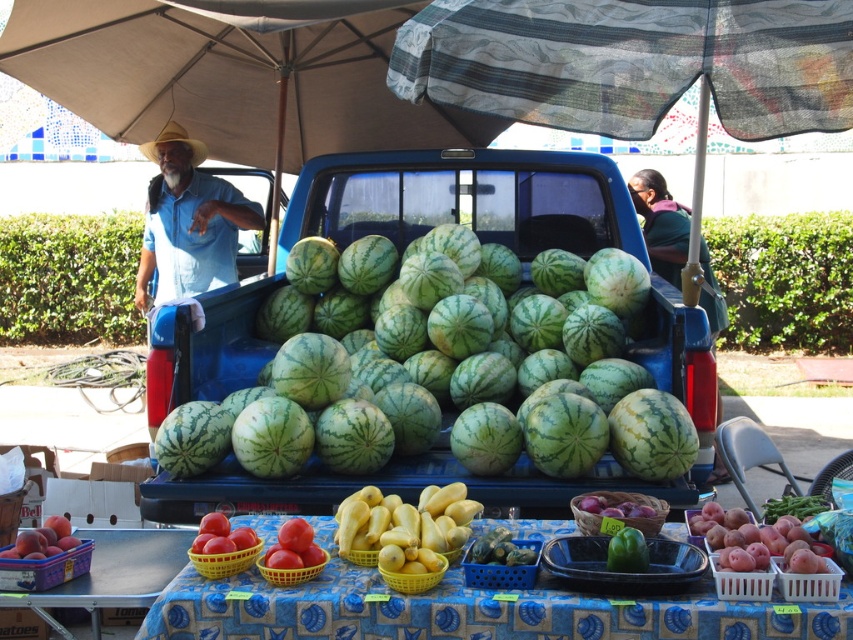
Is green striped watermelon at center taller than smooth red tomato at lower left?

Correct, green striped watermelon at center is much taller as smooth red tomato at lower left.

Between green striped watermelon at center and smooth red tomato at lower left, which one appears on the right side from the viewer's perspective?

green striped watermelon at center

Where is `green striped watermelon at center`? green striped watermelon at center is located at coordinates (430, 378).

Locate an element on the screen. green striped watermelon at center is located at coordinates (430, 378).

Who is more forward, (277, 424) or (724, 568)?

Positioned in front is point (724, 568).

How distant is green striped watermelon at center from smooth red potatoes at lower right?

They are 1.49 meters apart.

Identify the location of green striped watermelon at center. This screenshot has height=640, width=853. pyautogui.click(x=430, y=378).

Does point (231, 77) come closer to viewer compared to point (227, 624)?

No.

Which is below, beige fabric umbrella at upper center or smooth plastic table at center?

smooth plastic table at center is below.

In order to click on beige fabric umbrella at upper center in this screenshot , I will do `click(234, 74)`.

Where is `beige fabric umbrella at upper center`? The image size is (853, 640). beige fabric umbrella at upper center is located at coordinates (234, 74).